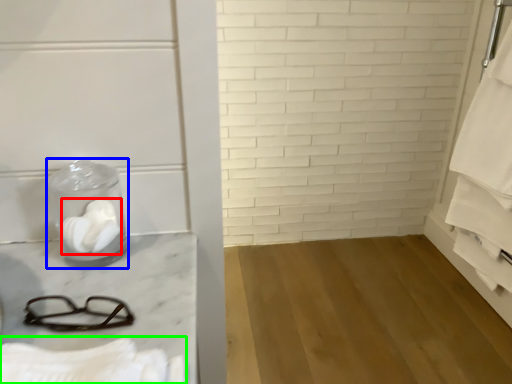
Question: Estimate the real-world distances between objects in this image. Which object is farther from toilet paper (highlighted by a red box), glass jar (highlighted by a blue box) or bath towel (highlighted by a green box)?

Choices:
 (A) glass jar
 (B) bath towel

Answer: (B)